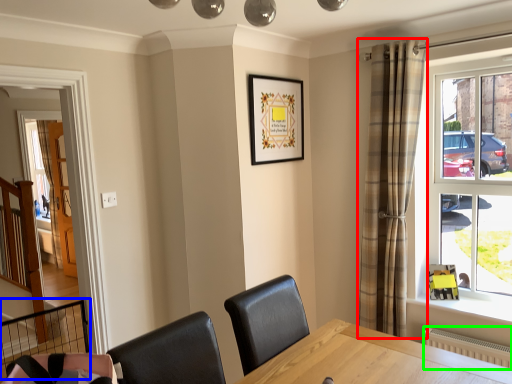
Question: Which is nearer to the curtain (highlighted by a red box)? balustrade (highlighted by a blue box) or radiator (highlighted by a green box).

Choices:
 (A) balustrade
 (B) radiator

Answer: (B)